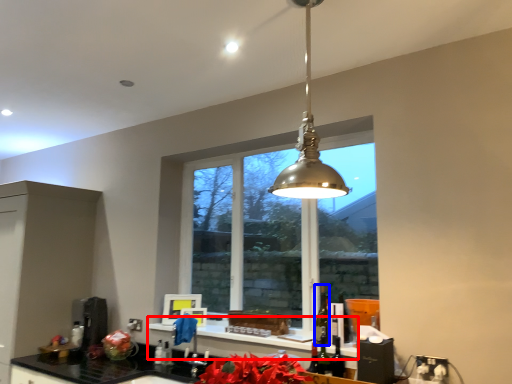
Question: Which object is further to the camera taking this photo, window sill (highlighted by a red box) or alcohol (highlighted by a blue box)?

Choices:
 (A) window sill
 (B) alcohol

Answer: (B)